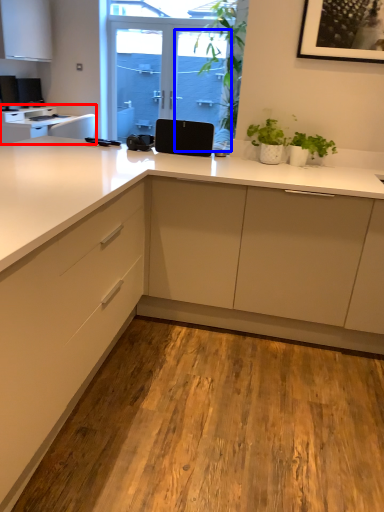
Question: Among these objects, which one is farthest to the camera, countertop (highlighted by a red box) or screen door (highlighted by a blue box)?

Choices:
 (A) countertop
 (B) screen door

Answer: (B)